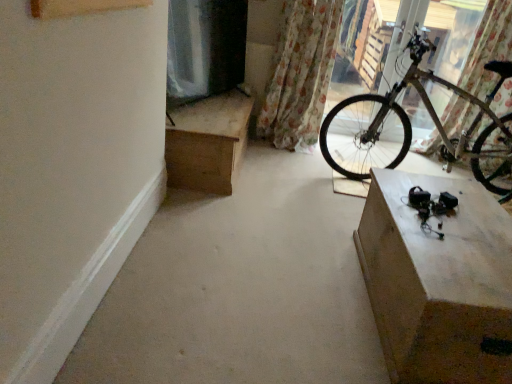
Where is `blank space to the left of matte concrete cabinet at lower right`? The height and width of the screenshot is (384, 512). blank space to the left of matte concrete cabinet at lower right is located at coordinates (281, 279).